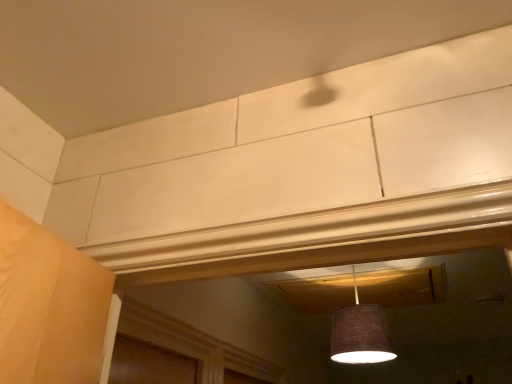
In order to face brown fabric lampshade at center, should I rotate leftwards or rightwards?

Turn right approximately 13.654 degrees to face it.

This screenshot has width=512, height=384. What do you see at coordinates (360, 333) in the screenshot?
I see `brown fabric lampshade at center` at bounding box center [360, 333].

I want to click on brown fabric lampshade at center, so click(360, 333).

Where is `brown fabric lampshade at center`? This screenshot has width=512, height=384. brown fabric lampshade at center is located at coordinates (360, 333).